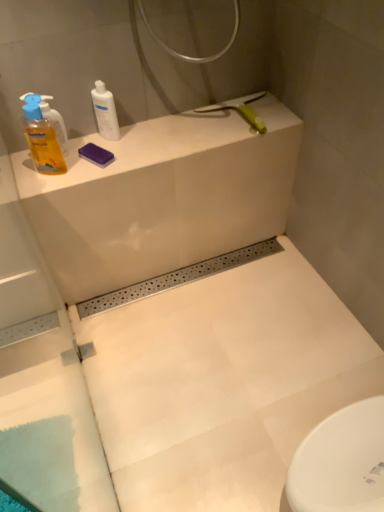
Question: Does yellow translucent liquid at left, the 2th cleaning product from the right, have a larger size compared to white matte counter top at upper left?

Choices:
 (A) yes
 (B) no

Answer: (B)

Question: Is yellow translucent liquid at left, the 2th cleaning product from the right, thinner than white matte counter top at upper left?

Choices:
 (A) no
 (B) yes

Answer: (B)

Question: Are yellow translucent liquid at left, the 2th cleaning product from the right, and white matte counter top at upper left beside each other?

Choices:
 (A) yes
 (B) no

Answer: (B)

Question: From a real-world perspective, is yellow translucent liquid at left, the 2th cleaning product from the right, under white matte counter top at upper left?

Choices:
 (A) yes
 (B) no

Answer: (B)

Question: Is yellow translucent liquid at left, which is the 1th cleaning product in left-to-right order, outside white matte counter top at upper left?

Choices:
 (A) yes
 (B) no

Answer: (A)

Question: Does yellow translucent liquid at left, which is the 1th cleaning product in left-to-right order, appear on the right side of white matte counter top at upper left?

Choices:
 (A) no
 (B) yes

Answer: (A)

Question: From the image's perspective, is yellow translucent liquid at left, the 2th cleaning product from the right, on top of white glossy bottle at upper left, which is counted as the 1th cleaning product, starting from the right?

Choices:
 (A) no
 (B) yes

Answer: (A)

Question: Is yellow translucent liquid at left, which is the 1th cleaning product in left-to-right order, placed right next to white glossy bottle at upper left, arranged as the 2th cleaning product when viewed from the left?

Choices:
 (A) no
 (B) yes

Answer: (A)

Question: Is yellow translucent liquid at left, which is the 1th cleaning product in left-to-right order, looking in the opposite direction of white glossy bottle at upper left, which is counted as the 1th cleaning product, starting from the right?

Choices:
 (A) no
 (B) yes

Answer: (A)

Question: Can you confirm if yellow translucent liquid at left, the 2th cleaning product from the right, is bigger than white glossy bottle at upper left, which is counted as the 1th cleaning product, starting from the right?

Choices:
 (A) yes
 (B) no

Answer: (A)

Question: From a real-world perspective, is yellow translucent liquid at left, which is the 1th cleaning product in left-to-right order, physically below white glossy bottle at upper left, which is counted as the 1th cleaning product, starting from the right?

Choices:
 (A) no
 (B) yes

Answer: (A)

Question: From a real-world perspective, is yellow translucent liquid at left, the 2th cleaning product from the right, over white glossy bottle at upper left, which is counted as the 1th cleaning product, starting from the right?

Choices:
 (A) yes
 (B) no

Answer: (A)

Question: From the image's perspective, is white glossy bottle at upper left, arranged as the 2th cleaning product when viewed from the left, under yellow translucent liquid at left, the 2th cleaning product from the right?

Choices:
 (A) no
 (B) yes

Answer: (A)